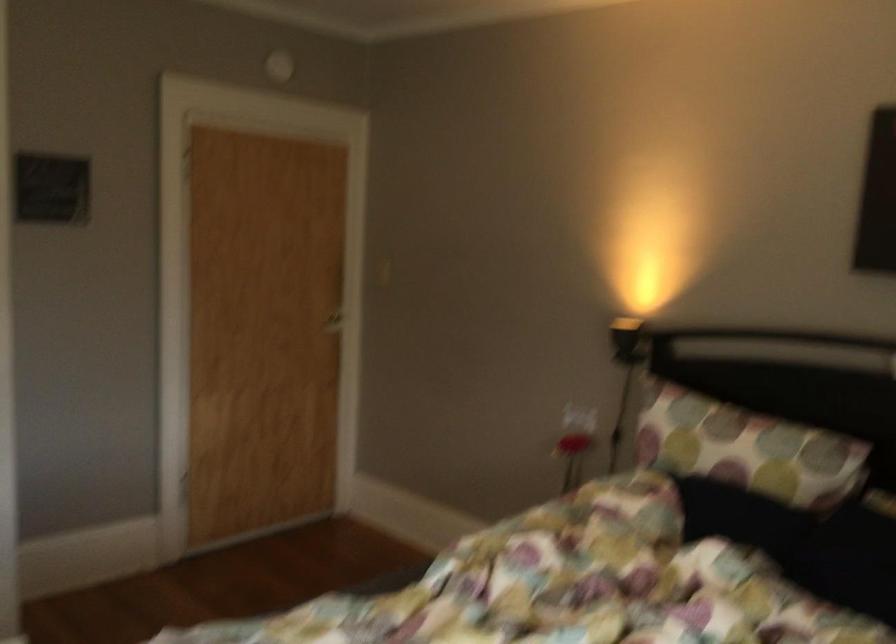
Find where to pull the door handle. Please return your answer as a coordinate pair (x, y).

(328, 319)